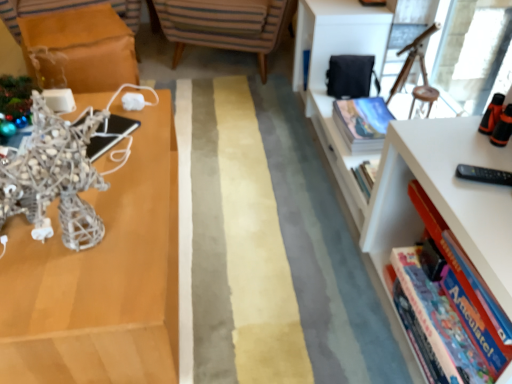
Question: Is white plastic bookcase at right shorter than matte silver sculpture at left?

Choices:
 (A) yes
 (B) no

Answer: (B)

Question: From the image's perspective, is white plastic bookcase at right located beneath matte silver sculpture at left?

Choices:
 (A) yes
 (B) no

Answer: (B)

Question: Considering the relative sizes of white plastic bookcase at right and matte silver sculpture at left in the image provided, is white plastic bookcase at right wider than matte silver sculpture at left?

Choices:
 (A) no
 (B) yes

Answer: (A)

Question: Is matte silver sculpture at left a part of white plastic bookcase at right?

Choices:
 (A) no
 (B) yes

Answer: (A)

Question: Is white plastic bookcase at right smaller than matte silver sculpture at left?

Choices:
 (A) no
 (B) yes

Answer: (A)

Question: Choose the correct answer: Is hardcover book at upper right, the second book in the front-to-back sequence, inside striped fabric chair at center or outside it?

Choices:
 (A) inside
 (B) outside

Answer: (B)

Question: Based on their sizes in the image, would you say hardcover book at upper right, the second book in the bottom-to-top sequence, is bigger or smaller than striped fabric chair at center?

Choices:
 (A) big
 (B) small

Answer: (B)

Question: Considering the positions of hardcover book at upper right, the second book in the front-to-back sequence, and striped fabric chair at center in the image, is hardcover book at upper right, the second book in the front-to-back sequence, taller or shorter than striped fabric chair at center?

Choices:
 (A) tall
 (B) short

Answer: (B)

Question: Considering their positions, is hardcover book at upper right, the second book in the bottom-to-top sequence, located in front of or behind striped fabric chair at center?

Choices:
 (A) front
 (B) behind

Answer: (A)

Question: Is hardcover book at upper right, marked as the 1th book in a top-to-bottom arrangement, bigger or smaller than hardcover book at right, arranged as the 2th book when viewed from the back?

Choices:
 (A) big
 (B) small

Answer: (B)

Question: Considering the positions of hardcover book at upper right, the 1th book viewed from the back, and hardcover book at right, which is the first book from front to back, in the image, is hardcover book at upper right, the 1th book viewed from the back, wider or thinner than hardcover book at right, which is the first book from front to back,?

Choices:
 (A) thin
 (B) wide

Answer: (A)

Question: From the image's perspective, relative to hardcover book at right, arranged as the 2th book when viewed from the back, is hardcover book at upper right, the second book in the bottom-to-top sequence, above or below?

Choices:
 (A) below
 (B) above

Answer: (B)

Question: From a real-world perspective, is hardcover book at upper right, the second book in the front-to-back sequence, positioned above or below hardcover book at right, the first book in the bottom-to-top sequence?

Choices:
 (A) above
 (B) below

Answer: (B)

Question: Which is correct: white plastic bookcase at right is inside hardcover book at right, the first book in the bottom-to-top sequence, or outside of it?

Choices:
 (A) inside
 (B) outside

Answer: (B)

Question: From a real-world perspective, is white plastic bookcase at right physically located above or below hardcover book at right, arranged as the 2th book when viewed from the back?

Choices:
 (A) above
 (B) below

Answer: (A)